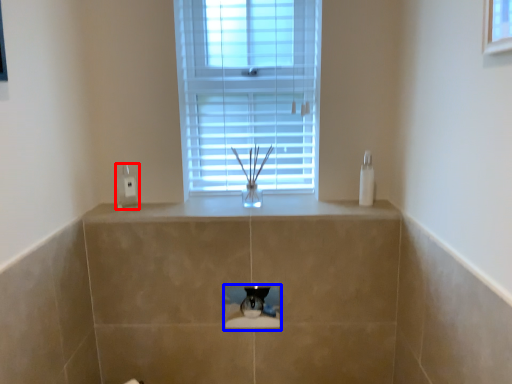
Question: Which object appears closest to the camera in this image, electric outlet (highlighted by a red box) or hole (highlighted by a blue box)?

Choices:
 (A) electric outlet
 (B) hole

Answer: (B)